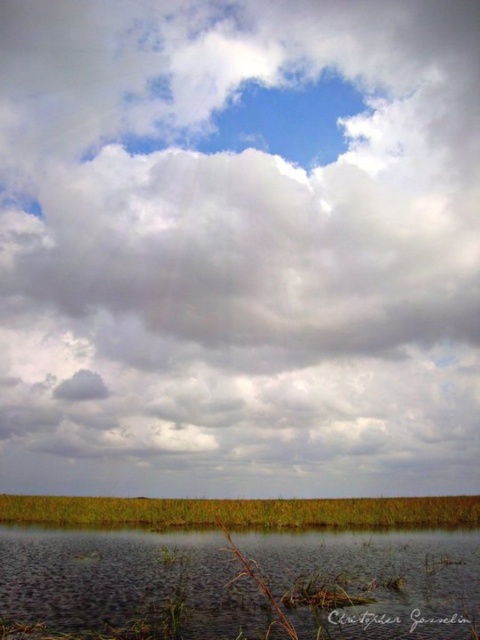
The height and width of the screenshot is (640, 480). What are the coordinates of `clear water at bottom` in the screenshot? It's located at (123, 579).

Find the location of `clear water at bottom`. clear water at bottom is located at coordinates (123, 579).